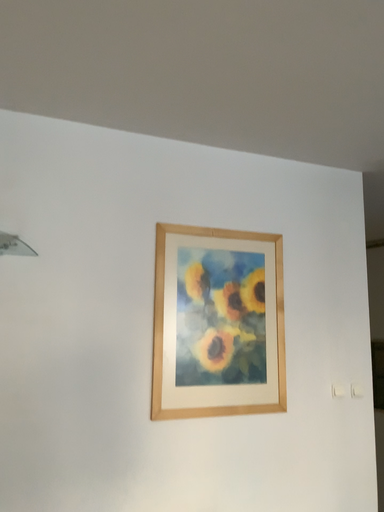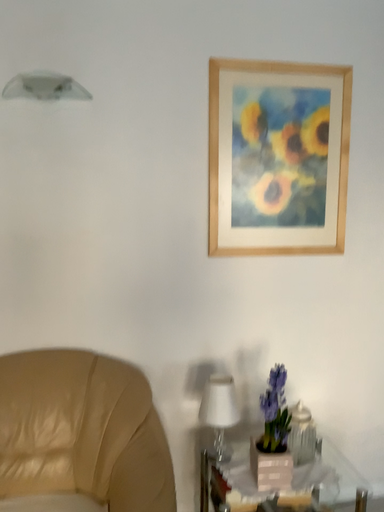
Question: Which way did the camera rotate in the video?

Choices:
 (A) rotated downward
 (B) rotated upward

Answer: (A)